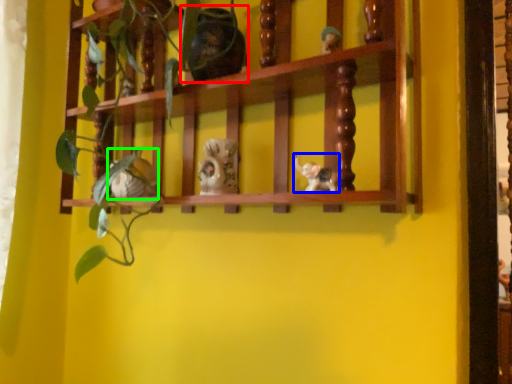
Question: Based on their relative distances, which object is nearer to toy (highlighted by a red box)? Choose from toy (highlighted by a blue box) and toy (highlighted by a green box).

Choices:
 (A) toy
 (B) toy

Answer: (A)